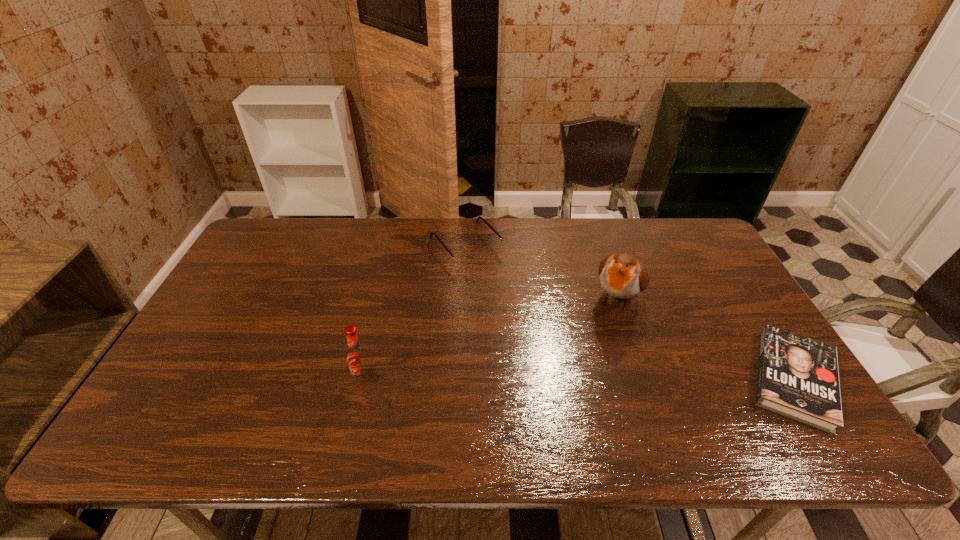
This screenshot has height=540, width=960. What are the coordinates of `vacant point at the far edge` in the screenshot? It's located at (349, 248).

This screenshot has height=540, width=960. Identify the location of free space at the near edge of the desktop. (264, 400).

This screenshot has width=960, height=540. Identify the location of free space at the left edge of the desktop. (232, 367).

This screenshot has width=960, height=540. Find the location of `free point at the right edge`. free point at the right edge is located at coordinates (711, 265).

The height and width of the screenshot is (540, 960). I want to click on free space at the far left corner of the desktop, so click(297, 220).

This screenshot has width=960, height=540. What are the coordinates of `vacant space at the near right corner of the desktop` in the screenshot? It's located at (739, 397).

Locate an element on the screen. free spot between the root beer and the bird is located at coordinates [492, 339].

You are a GUI agent. You are given a task and a screenshot of the screen. Output one action in this format:
    pyautogui.click(x=<x>, y=<y>)
    Task: Click on the vacant area between the rightmost object and the third object from right to left
    
    Given the screenshot: What is the action you would take?
    pyautogui.click(x=630, y=313)

I want to click on free space between the third nearest object and the second object from left to right, so click(542, 272).

This screenshot has width=960, height=540. Find the location of `empty space that is in between the bird and the second shortest object`. empty space that is in between the bird and the second shortest object is located at coordinates (542, 272).